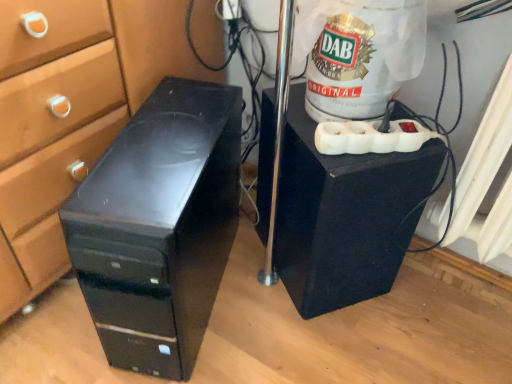
Question: From the image's perspective, is black matte speaker at center, which ranks as the 1th furniture in right-to-left order, on black plastic computer tower at left, arranged as the first furniture when viewed from the left?

Choices:
 (A) yes
 (B) no

Answer: (A)

Question: Is the position of black matte speaker at center, which is the 2th furniture in left-to-right order, less distant than that of black plastic computer tower at left, arranged as the first furniture when viewed from the left?

Choices:
 (A) no
 (B) yes

Answer: (A)

Question: Considering the relative sizes of black matte speaker at center, which is the 2th furniture in left-to-right order, and black plastic computer tower at left, which ranks as the 2th furniture in right-to-left order, in the image provided, is black matte speaker at center, which is the 2th furniture in left-to-right order, taller than black plastic computer tower at left, which ranks as the 2th furniture in right-to-left order,?

Choices:
 (A) yes
 (B) no

Answer: (B)

Question: Is black matte speaker at center, which is the 2th furniture in left-to-right order, positioned with its back to black plastic computer tower at left, arranged as the first furniture when viewed from the left?

Choices:
 (A) yes
 (B) no

Answer: (B)

Question: From a real-world perspective, is black matte speaker at center, which is the 2th furniture in left-to-right order, below black plastic computer tower at left, which ranks as the 2th furniture in right-to-left order?

Choices:
 (A) no
 (B) yes

Answer: (B)

Question: Considering the relative sizes of black matte speaker at center, which ranks as the 1th furniture in right-to-left order, and black plastic computer tower at left, which ranks as the 2th furniture in right-to-left order, in the image provided, is black matte speaker at center, which ranks as the 1th furniture in right-to-left order, wider than black plastic computer tower at left, which ranks as the 2th furniture in right-to-left order,?

Choices:
 (A) yes
 (B) no

Answer: (B)

Question: Is black plastic computer tower at left, which ranks as the 2th furniture in right-to-left order, positioned behind black matte speaker at center, which ranks as the 1th furniture in right-to-left order?

Choices:
 (A) yes
 (B) no

Answer: (B)

Question: Is black plastic computer tower at left, which ranks as the 2th furniture in right-to-left order, to the right of black matte speaker at center, which is the 2th furniture in left-to-right order, from the viewer's perspective?

Choices:
 (A) yes
 (B) no

Answer: (B)

Question: Considering the relative sizes of black plastic computer tower at left, which ranks as the 2th furniture in right-to-left order, and black matte speaker at center, which ranks as the 1th furniture in right-to-left order, in the image provided, is black plastic computer tower at left, which ranks as the 2th furniture in right-to-left order, shorter than black matte speaker at center, which ranks as the 1th furniture in right-to-left order,?

Choices:
 (A) yes
 (B) no

Answer: (B)

Question: Is black plastic computer tower at left, arranged as the first furniture when viewed from the left, aimed at black matte speaker at center, which ranks as the 1th furniture in right-to-left order?

Choices:
 (A) yes
 (B) no

Answer: (B)

Question: Considering the relative positions of black plastic computer tower at left, arranged as the first furniture when viewed from the left, and black matte speaker at center, which ranks as the 1th furniture in right-to-left order, in the image provided, is black plastic computer tower at left, arranged as the first furniture when viewed from the left, to the left of black matte speaker at center, which ranks as the 1th furniture in right-to-left order, from the viewer's perspective?

Choices:
 (A) yes
 (B) no

Answer: (A)

Question: Can you confirm if black plastic computer tower at left, which ranks as the 2th furniture in right-to-left order, is thinner than black matte speaker at center, which is the 2th furniture in left-to-right order?

Choices:
 (A) yes
 (B) no

Answer: (B)

Question: Which is correct: black plastic computer tower at left, which ranks as the 2th furniture in right-to-left order, is inside black matte speaker at center, which ranks as the 1th furniture in right-to-left order, or outside of it?

Choices:
 (A) inside
 (B) outside

Answer: (B)